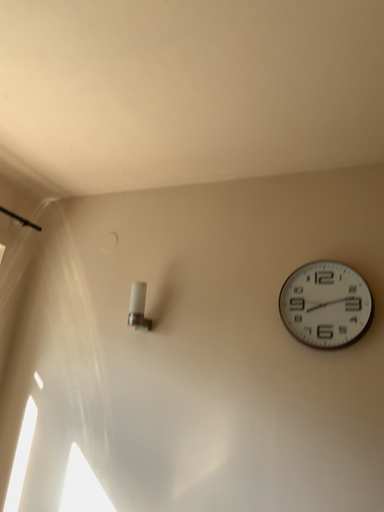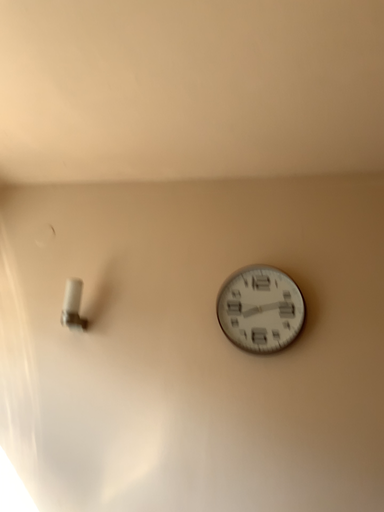
Question: How did the camera likely rotate when shooting the video?

Choices:
 (A) rotated right
 (B) rotated left

Answer: (A)